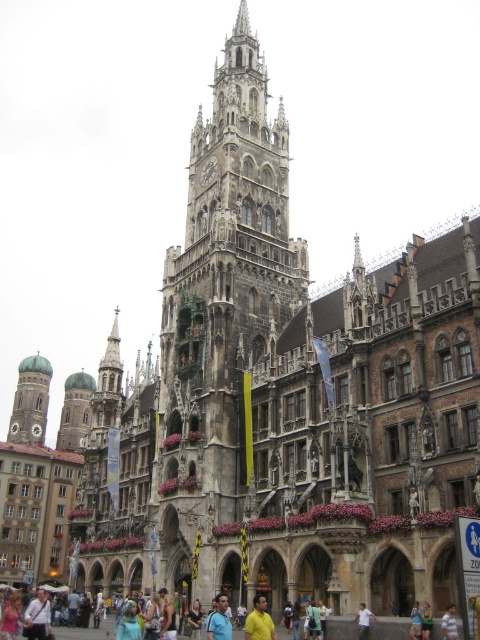
Looking at this image, you are standing in the city square facing the historic building. There are two points marked on the building facade. The first point is at coordinate (15, 420) and the second point is at coordinate (72, 412). Which of these two points is closer to you?

The point at coordinate (15, 420) is closer to the viewer than the point at coordinate (72, 412).

You are standing in the city square and see the yellow cotton shirt at center and the green stone tower at center. Which object is shorter?

The yellow cotton shirt at center is not as tall as the green stone tower at center, so the yellow cotton shirt at center is shorter.

Consider the image. You are standing in the city square and want to take a photo of the green copper dome at left. If your camera has a maximum focus range of 400 feet, will you need to move closer to capture it clearly?

The green copper dome at left is 430.04 feet away from the viewer. Since this exceeds the camera maximum focus range of 400 feet, you need to move closer to ensure the green copper dome at left is in focus.